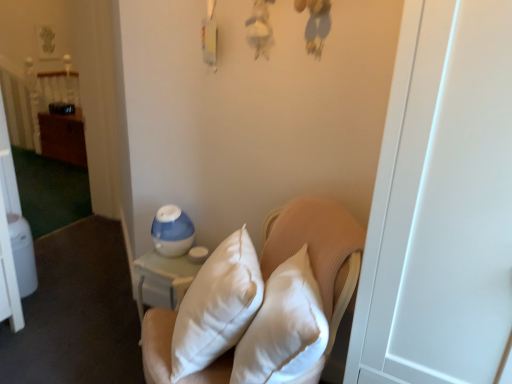
Question: Considering the relative sizes of wooden bed at left and wooden dresser at left in the image provided, is wooden bed at left bigger than wooden dresser at left?

Choices:
 (A) no
 (B) yes

Answer: (A)

Question: Is wooden bed at left turned away from wooden dresser at left?

Choices:
 (A) yes
 (B) no

Answer: (B)

Question: Can we say wooden bed at left lies outside wooden dresser at left?

Choices:
 (A) no
 (B) yes

Answer: (B)

Question: Does wooden bed at left appear on the right side of wooden dresser at left?

Choices:
 (A) yes
 (B) no

Answer: (B)

Question: Is wooden bed at left wider than wooden dresser at left?

Choices:
 (A) no
 (B) yes

Answer: (A)

Question: Considering the relative positions of wooden bed at left and wooden dresser at left in the image provided, is wooden bed at left in front of wooden dresser at left?

Choices:
 (A) no
 (B) yes

Answer: (A)

Question: Is white quilted pillows at center looking in the opposite direction of wooden dresser at left?

Choices:
 (A) yes
 (B) no

Answer: (B)

Question: Is white quilted pillows at center not near wooden dresser at left?

Choices:
 (A) no
 (B) yes

Answer: (B)

Question: Does white quilted pillows at center have a lesser width compared to wooden dresser at left?

Choices:
 (A) yes
 (B) no

Answer: (B)

Question: Can you confirm if white quilted pillows at center is wider than wooden dresser at left?

Choices:
 (A) no
 (B) yes

Answer: (B)

Question: Does white quilted pillows at center appear on the right side of wooden dresser at left?

Choices:
 (A) yes
 (B) no

Answer: (A)

Question: Is wooden dresser at left surrounded by white quilted pillows at center?

Choices:
 (A) yes
 (B) no

Answer: (B)

Question: From a real-world perspective, is wooden bed at left physically above white quilted pillows at center?

Choices:
 (A) yes
 (B) no

Answer: (A)